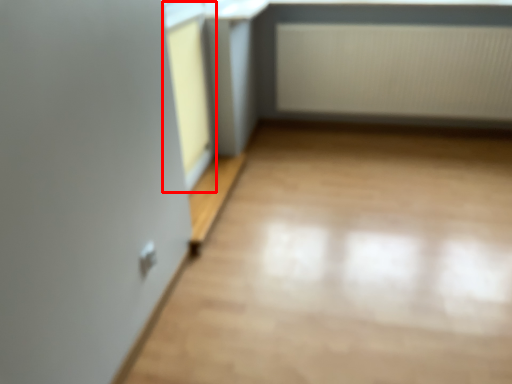
Question: Observing the image, what is the correct spatial positioning of window frame (annotated by the red box) in reference to radiator?

Choices:
 (A) left
 (B) right

Answer: (A)